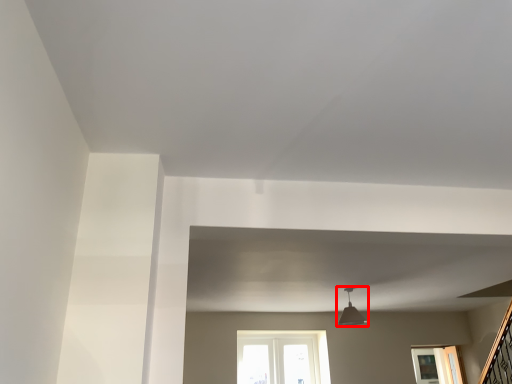
Question: Observing the image, what is the correct spatial positioning of light fixture (annotated by the red box) in reference to window?

Choices:
 (A) left
 (B) right

Answer: (A)